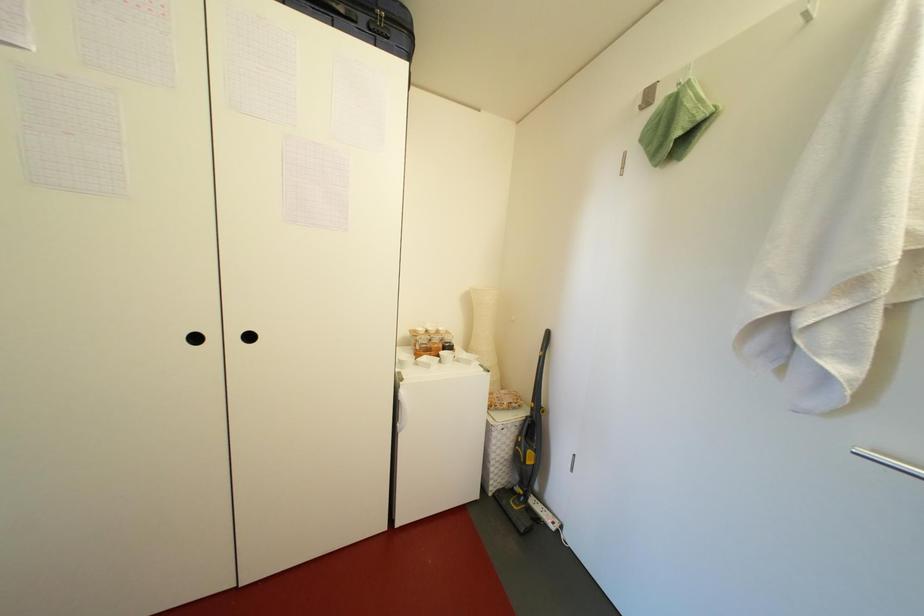
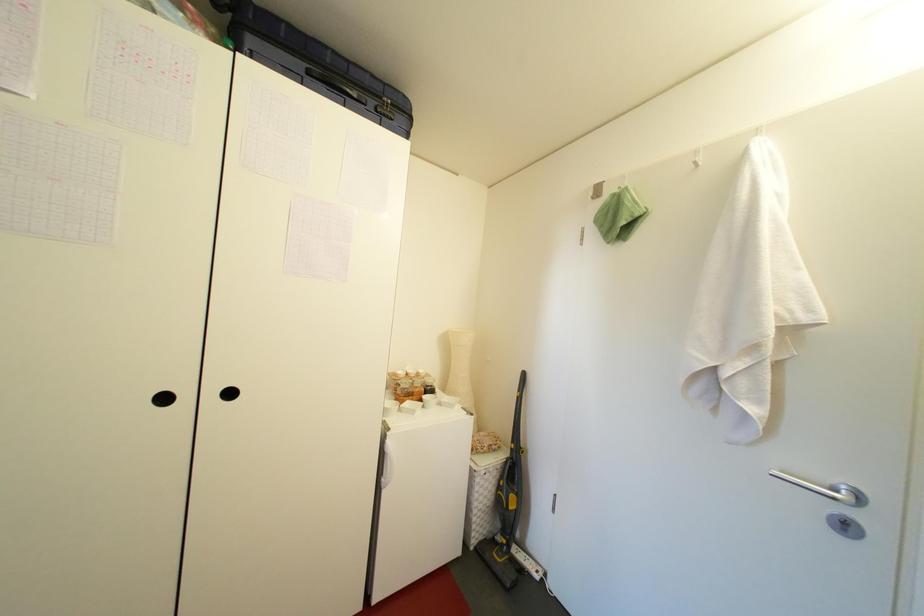
From the picture: What movement of the cameraman would produce the second image?

The cameraman moved toward left, backward.